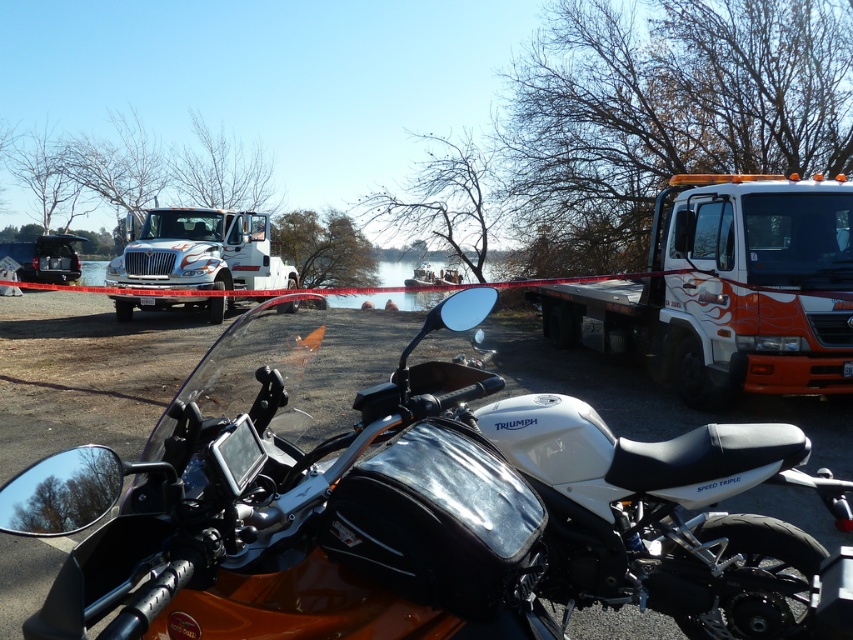
Question: Can you confirm if orange flame-painted flatbed truck at right is positioned to the right of white glossy truck at upper left?

Choices:
 (A) yes
 (B) no

Answer: (A)

Question: Which object is positioned farthest from the white glossy truck at upper left?

Choices:
 (A) orange flame-painted flatbed truck at right
 (B) white matte motorcycle at center

Answer: (A)

Question: Is white matte motorcycle at center to the right of orange flame-painted flatbed truck at right from the viewer's perspective?

Choices:
 (A) no
 (B) yes

Answer: (A)

Question: Which object appears closest to the camera in this image?

Choices:
 (A) white glossy truck at upper left
 (B) orange flame-painted flatbed truck at right
 (C) white matte motorcycle at center

Answer: (C)

Question: Which object is farther from the camera taking this photo?

Choices:
 (A) white glossy truck at upper left
 (B) orange flame-painted flatbed truck at right
 (C) white matte motorcycle at center

Answer: (A)

Question: Does white matte motorcycle at center appear on the right side of orange flame-painted flatbed truck at right?

Choices:
 (A) no
 (B) yes

Answer: (A)